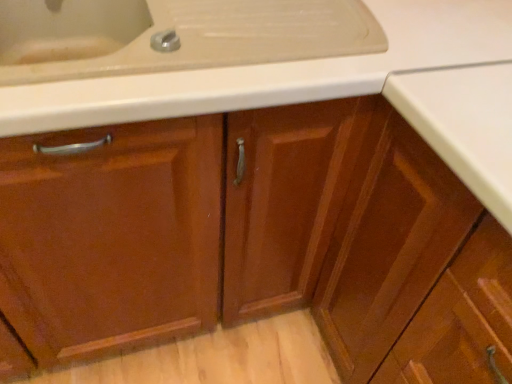
Measure the distance between beige laminate counter top at center and camera.

beige laminate counter top at center is 53.90 centimeters away from camera.

At what (x,y) coordinates should I click in order to perform the action: click on beige laminate counter top at center. Please return your answer as a coordinate pair (x, y). The width and height of the screenshot is (512, 384). Looking at the image, I should click on (271, 72).

Describe the element at coordinates (271, 72) in the screenshot. I see `beige laminate counter top at center` at that location.

Locate an element on the screen. The height and width of the screenshot is (384, 512). beige laminate counter top at center is located at coordinates (271, 72).